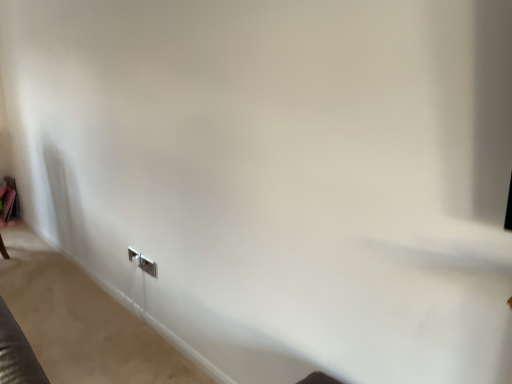
The width and height of the screenshot is (512, 384). I want to click on white plastic electric outlet at lower left, acting as the 2th electric outlet starting from the right, so click(133, 254).

This screenshot has width=512, height=384. What do you see at coordinates (133, 254) in the screenshot? I see `white plastic electric outlet at lower left, which appears as the first electric outlet when viewed from the left` at bounding box center [133, 254].

I want to click on white plastic electric outlet at lower center, which ranks as the first electric outlet in front-to-back order, so click(148, 266).

How much space does white plastic electric outlet at lower center, the 1th electric outlet viewed from the right, occupy horizontally?

0.57 inches.

What do you see at coordinates (148, 266) in the screenshot?
I see `white plastic electric outlet at lower center, positioned as the 2th electric outlet in back-to-front order` at bounding box center [148, 266].

At what (x,y) coordinates should I click in order to perform the action: click on white plastic electric outlet at lower left, which appears as the first electric outlet when viewed from the left. Please return your answer as a coordinate pair (x, y). Image resolution: width=512 pixels, height=384 pixels. Looking at the image, I should click on (133, 254).

Between white plastic electric outlet at lower center, which ranks as the first electric outlet in front-to-back order, and white plastic electric outlet at lower left, which ranks as the 1th electric outlet in back-to-front order, which one appears on the left side from the viewer's perspective?

white plastic electric outlet at lower left, which ranks as the 1th electric outlet in back-to-front order.

Is white plastic electric outlet at lower center, positioned as the 2th electric outlet in back-to-front order, in front of white plastic electric outlet at lower left, which appears as the first electric outlet when viewed from the left?

Yes, white plastic electric outlet at lower center, positioned as the 2th electric outlet in back-to-front order, is closer to the camera.

Considering the positions of point (144, 259) and point (137, 253), is point (144, 259) closer or farther from the camera than point (137, 253)?

Point (144, 259) is positioned closer to the camera compared to point (137, 253).

From the image's perspective, which is below, white plastic electric outlet at lower center, which ranks as the first electric outlet in front-to-back order, or white plastic electric outlet at lower left, placed as the second electric outlet when sorted from front to back?

→ white plastic electric outlet at lower center, which ranks as the first electric outlet in front-to-back order, from the image's perspective.

From a real-world perspective, which is physically below, white plastic electric outlet at lower center, positioned as the 2th electric outlet in back-to-front order, or white plastic electric outlet at lower left, which appears as the first electric outlet when viewed from the left?

white plastic electric outlet at lower left, which appears as the first electric outlet when viewed from the left, is physically lower.

Does white plastic electric outlet at lower center, arranged as the 2th electric outlet when viewed from the left, have a lesser width compared to white plastic electric outlet at lower left, acting as the 2th electric outlet starting from the right?

Correct, the width of white plastic electric outlet at lower center, arranged as the 2th electric outlet when viewed from the left, is less than that of white plastic electric outlet at lower left, acting as the 2th electric outlet starting from the right.

Is white plastic electric outlet at lower center, positioned as the 2th electric outlet in back-to-front order, taller or shorter than white plastic electric outlet at lower left, which ranks as the 1th electric outlet in back-to-front order?

In the image, white plastic electric outlet at lower center, positioned as the 2th electric outlet in back-to-front order, appears to be taller than white plastic electric outlet at lower left, which ranks as the 1th electric outlet in back-to-front order.

Is white plastic electric outlet at lower center, the 1th electric outlet viewed from the right, bigger than white plastic electric outlet at lower left, which ranks as the 1th electric outlet in back-to-front order?

Incorrect, white plastic electric outlet at lower center, the 1th electric outlet viewed from the right, is not larger than white plastic electric outlet at lower left, which ranks as the 1th electric outlet in back-to-front order.

Is white plastic electric outlet at lower center, positioned as the 2th electric outlet in back-to-front order, situated inside white plastic electric outlet at lower left, placed as the second electric outlet when sorted from front to back, or outside?

white plastic electric outlet at lower center, positioned as the 2th electric outlet in back-to-front order, is not enclosed by white plastic electric outlet at lower left, placed as the second electric outlet when sorted from front to back.

Is white plastic electric outlet at lower center, positioned as the 2th electric outlet in back-to-front order, not close to white plastic electric outlet at lower left, which appears as the first electric outlet when viewed from the left?

white plastic electric outlet at lower center, positioned as the 2th electric outlet in back-to-front order, is near white plastic electric outlet at lower left, which appears as the first electric outlet when viewed from the left, not far away.

Does white plastic electric outlet at lower center, arranged as the 2th electric outlet when viewed from the left, turn towards white plastic electric outlet at lower left, acting as the 2th electric outlet starting from the right?

No, white plastic electric outlet at lower center, arranged as the 2th electric outlet when viewed from the left, is not aimed at white plastic electric outlet at lower left, acting as the 2th electric outlet starting from the right.

In the scene shown: Can you tell me how much white plastic electric outlet at lower center, positioned as the 2th electric outlet in back-to-front order, and white plastic electric outlet at lower left, which ranks as the 1th electric outlet in back-to-front order, differ in facing direction?

The angle between the facing direction of white plastic electric outlet at lower center, positioned as the 2th electric outlet in back-to-front order, and the facing direction of white plastic electric outlet at lower left, which ranks as the 1th electric outlet in back-to-front order, is 1.75 degrees.

How distant is white plastic electric outlet at lower center, which ranks as the first electric outlet in front-to-back order, from white plastic electric outlet at lower left, acting as the 2th electric outlet starting from the right?

white plastic electric outlet at lower center, which ranks as the first electric outlet in front-to-back order, is 4.08 inches from white plastic electric outlet at lower left, acting as the 2th electric outlet starting from the right.

This screenshot has width=512, height=384. I want to click on electric outlet lying above the white plastic electric outlet at lower center, arranged as the 2th electric outlet when viewed from the left (from the image's perspective), so click(133, 254).

Consider the image. Is white plastic electric outlet at lower left, which appears as the first electric outlet when viewed from the left, at the right side of white plastic electric outlet at lower center, which ranks as the first electric outlet in front-to-back order?

No, white plastic electric outlet at lower left, which appears as the first electric outlet when viewed from the left, is not to the right of white plastic electric outlet at lower center, which ranks as the first electric outlet in front-to-back order.

Considering their positions, is white plastic electric outlet at lower left, placed as the second electric outlet when sorted from front to back, located in front of or behind white plastic electric outlet at lower center, positioned as the 2th electric outlet in back-to-front order?

white plastic electric outlet at lower left, placed as the second electric outlet when sorted from front to back, is positioned farther from the viewer than white plastic electric outlet at lower center, positioned as the 2th electric outlet in back-to-front order.

Does point (138, 254) come farther from viewer compared to point (144, 258)?

Yes.

From the image's perspective, is white plastic electric outlet at lower left, which ranks as the 1th electric outlet in back-to-front order, positioned above or below white plastic electric outlet at lower center, positioned as the 2th electric outlet in back-to-front order?

From the image's perspective, white plastic electric outlet at lower left, which ranks as the 1th electric outlet in back-to-front order, appears above white plastic electric outlet at lower center, positioned as the 2th electric outlet in back-to-front order.

From a real-world perspective, is white plastic electric outlet at lower left, acting as the 2th electric outlet starting from the right, physically below white plastic electric outlet at lower center, the 1th electric outlet viewed from the right?

Yes, from a real-world perspective, white plastic electric outlet at lower left, acting as the 2th electric outlet starting from the right, is below white plastic electric outlet at lower center, the 1th electric outlet viewed from the right.

Which of these two, white plastic electric outlet at lower left, which appears as the first electric outlet when viewed from the left, or white plastic electric outlet at lower center, arranged as the 2th electric outlet when viewed from the left, is thinner?

white plastic electric outlet at lower center, arranged as the 2th electric outlet when viewed from the left, is thinner.

From the picture: Can you confirm if white plastic electric outlet at lower left, which appears as the first electric outlet when viewed from the left, is shorter than white plastic electric outlet at lower center, which ranks as the first electric outlet in front-to-back order?

Correct, white plastic electric outlet at lower left, which appears as the first electric outlet when viewed from the left, is not as tall as white plastic electric outlet at lower center, which ranks as the first electric outlet in front-to-back order.

Which of these two, white plastic electric outlet at lower left, acting as the 2th electric outlet starting from the right, or white plastic electric outlet at lower center, the 1th electric outlet viewed from the right, is bigger?

Bigger between the two is white plastic electric outlet at lower left, acting as the 2th electric outlet starting from the right.

Does white plastic electric outlet at lower left, which ranks as the 1th electric outlet in back-to-front order, contain white plastic electric outlet at lower center, arranged as the 2th electric outlet when viewed from the left?

No, white plastic electric outlet at lower center, arranged as the 2th electric outlet when viewed from the left, is not inside white plastic electric outlet at lower left, which ranks as the 1th electric outlet in back-to-front order.

Is white plastic electric outlet at lower left, placed as the second electric outlet when sorted from front to back, not close to white plastic electric outlet at lower center, the 1th electric outlet viewed from the right?

No, white plastic electric outlet at lower left, placed as the second electric outlet when sorted from front to back, is not far away from white plastic electric outlet at lower center, the 1th electric outlet viewed from the right.

Is white plastic electric outlet at lower left, which appears as the first electric outlet when viewed from the left, oriented away from white plastic electric outlet at lower center, the 1th electric outlet viewed from the right?

No, white plastic electric outlet at lower left, which appears as the first electric outlet when viewed from the left, is not facing away from white plastic electric outlet at lower center, the 1th electric outlet viewed from the right.

Looking at this image, what's the angular difference between white plastic electric outlet at lower left, which appears as the first electric outlet when viewed from the left, and white plastic electric outlet at lower center, which ranks as the first electric outlet in front-to-back order,'s facing directions?

The facing directions of white plastic electric outlet at lower left, which appears as the first electric outlet when viewed from the left, and white plastic electric outlet at lower center, which ranks as the first electric outlet in front-to-back order, are 1.75 degrees apart.

I want to click on electric outlet below the white plastic electric outlet at lower left, which ranks as the 1th electric outlet in back-to-front order (from the image's perspective), so click(x=148, y=266).

Locate an element on the screen. electric outlet above the white plastic electric outlet at lower left, which ranks as the 1th electric outlet in back-to-front order (from a real-world perspective) is located at coordinates (148, 266).

Find the location of a particular element. electric outlet behind the white plastic electric outlet at lower center, arranged as the 2th electric outlet when viewed from the left is located at coordinates (133, 254).